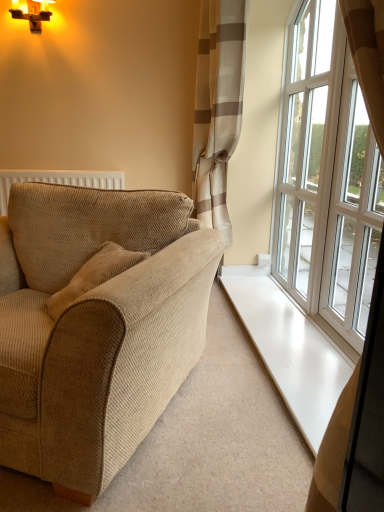
Question: In terms of size, does beige textured curtain at upper right appear bigger or smaller than white glass window at right, positioned as the second window in back-to-front order?

Choices:
 (A) small
 (B) big

Answer: (B)

Question: From their relative heights in the image, would you say beige textured curtain at upper right is taller or shorter than white glass window at right, which is the first window from front to back?

Choices:
 (A) short
 (B) tall

Answer: (B)

Question: Which is farther from the white glass window at right, positioned as the second window in back-to-front order?

Choices:
 (A) beige textured curtain at upper right
 (B) beige corduroy couch at left
 (C) wooden cross at upper left
 (D) white glass window at right, which is counted as the 1th window, starting from the back

Answer: (C)

Question: Which object is positioned farthest from the beige textured curtain at upper right?

Choices:
 (A) beige corduroy couch at left
 (B) white glass window at right, which is the first window from front to back
 (C) wooden cross at upper left
 (D) white glass window at right, acting as the 2th window starting from the front

Answer: (A)